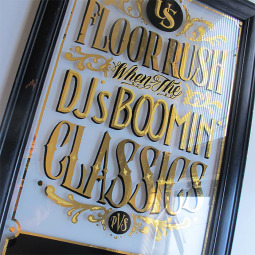
Locate an element on the screen. The image size is (255, 255). wall is located at coordinates (5, 65), (249, 212).